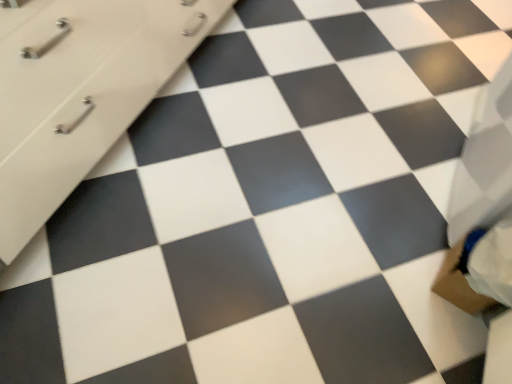
This screenshot has width=512, height=384. What do you see at coordinates (79, 92) in the screenshot?
I see `matte white chest of drawers at upper left` at bounding box center [79, 92].

You are a GUI agent. You are given a task and a screenshot of the screen. Output one action in this format:
    pyautogui.click(x=<x>, y=<y>)
    Task: Click on the matte white chest of drawers at upper left
    
    Given the screenshot: What is the action you would take?
    pyautogui.click(x=79, y=92)

Find the location of `matte white chest of drawers at upper left`. matte white chest of drawers at upper left is located at coordinates (79, 92).